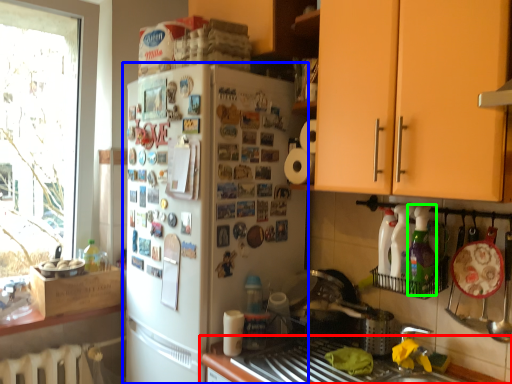
Question: Which object is positioned closest to countertop (highlighted by a red box)? Select from refrigerator (highlighted by a blue box) and bottle (highlighted by a green box).

Choices:
 (A) refrigerator
 (B) bottle

Answer: (A)